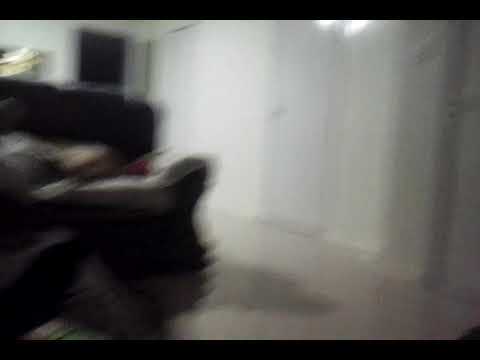
This screenshot has width=480, height=360. In order to click on wall in this screenshot , I will do `click(228, 77)`.